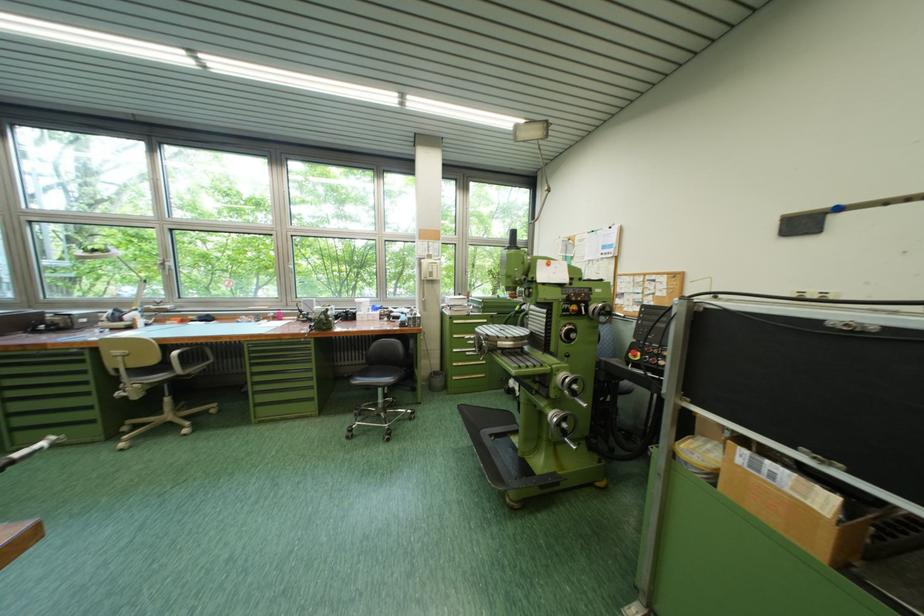
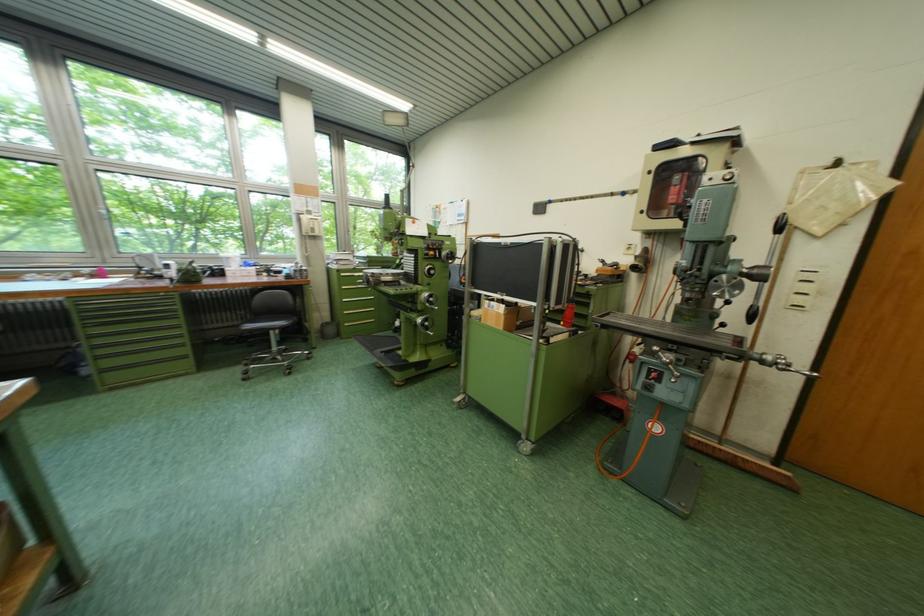
The point at (x=374, y=360) is marked in the first image. Where is the corresponding point in the second image?

(249, 320)